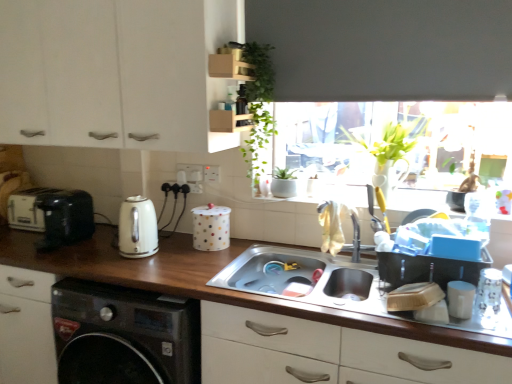
Locate an element on the screen. vacant area to the left of matte black toaster at left, which is the second appliance in front-to-back order is located at coordinates (21, 241).